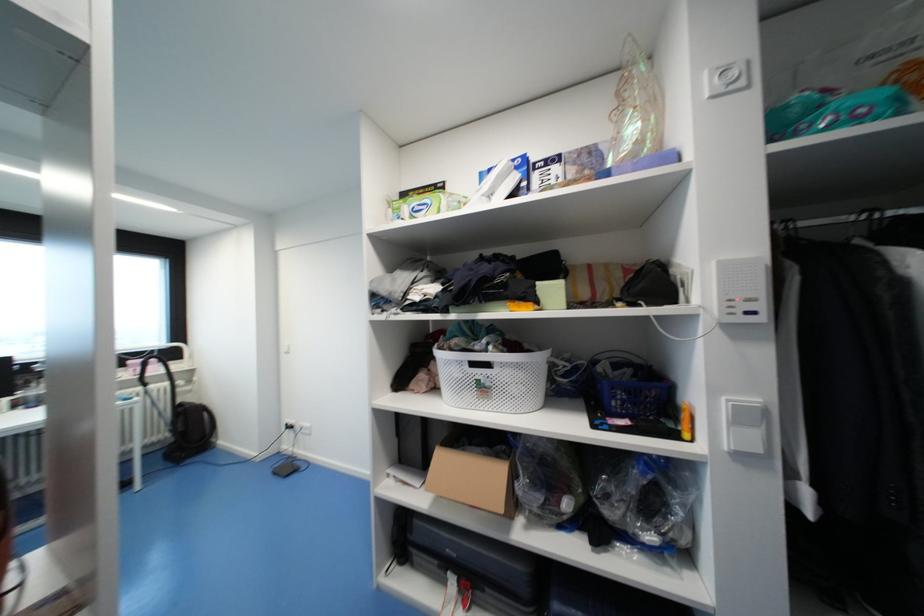
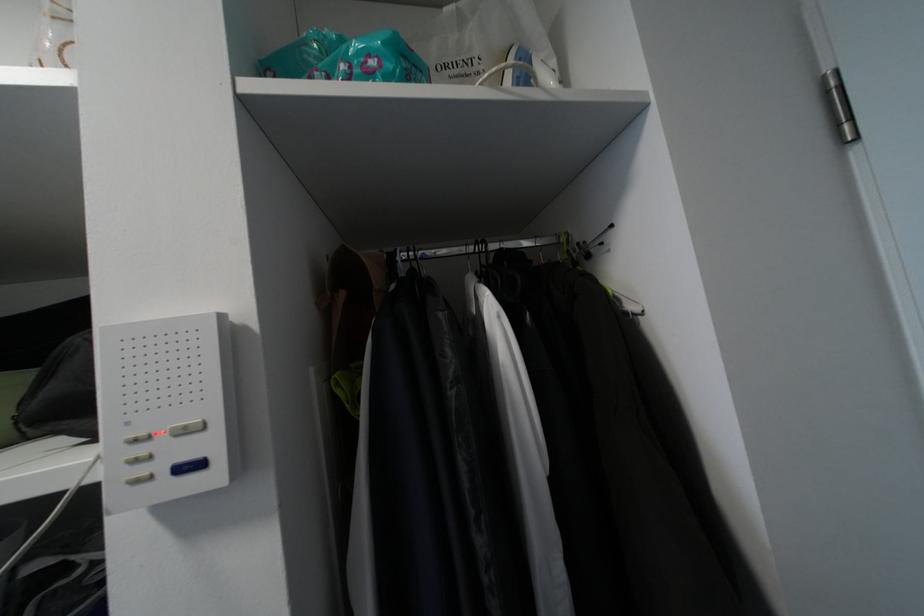
Find the pixel in the second image that matches the point at 755,301 in the first image.

(187, 432)